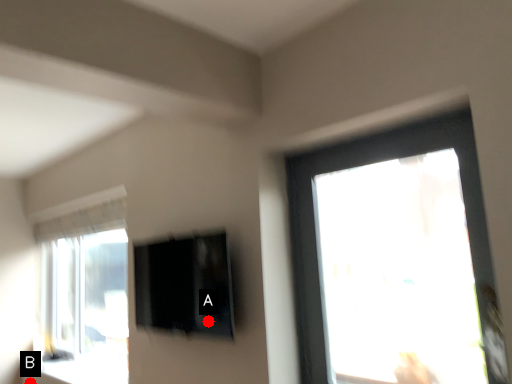
Question: Two points are circled on the image, labeled by A and B beside each circle. Which point appears closest to the camera in this image?

Choices:
 (A) A is closer
 (B) B is closer

Answer: (A)